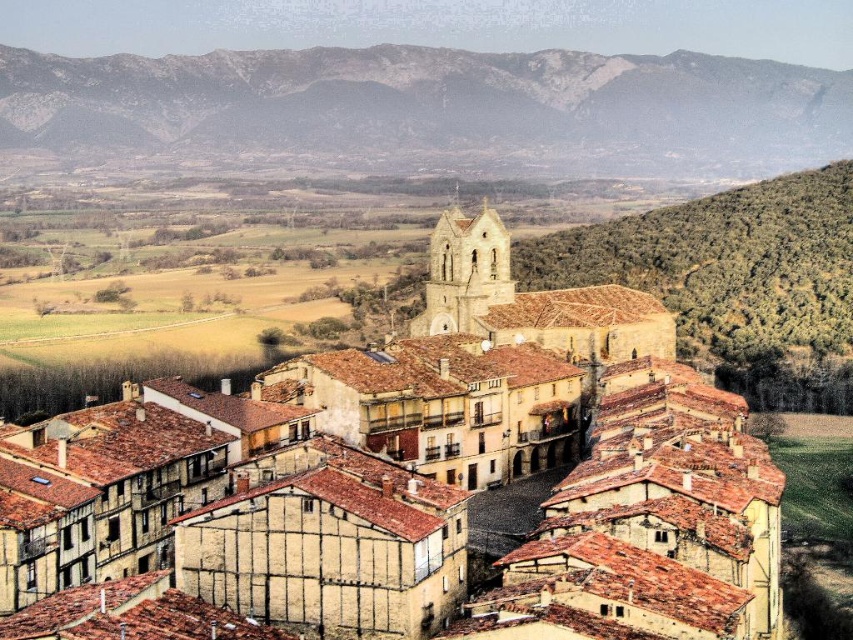
Question: Can you confirm if brown clay roof tiles at center is positioned to the right of rugged stone mountain at upper left?

Choices:
 (A) yes
 (B) no

Answer: (A)

Question: Which point is closer to the camera taking this photo?

Choices:
 (A) (718, 161)
 (B) (372, 349)

Answer: (B)

Question: Among these points, which one is farthest from the camera?

Choices:
 (A) (308, 426)
 (B) (527, 120)

Answer: (B)

Question: In this image, where is brown clay roof tiles at center located relative to rugged stone mountain at upper left?

Choices:
 (A) right
 (B) left

Answer: (A)

Question: Can you confirm if brown clay roof tiles at center is positioned above rugged stone mountain at upper left?

Choices:
 (A) no
 (B) yes

Answer: (A)